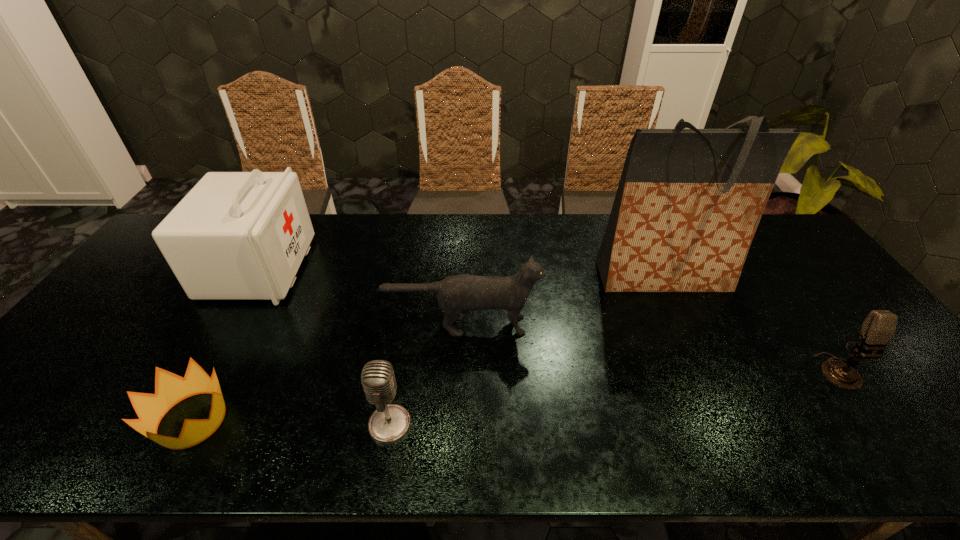
Identify the location of free space between the fifth shortest object and the nearer microphone. (324, 346).

Where is `empty location between the nearer microphone and the first-aid kit`? empty location between the nearer microphone and the first-aid kit is located at coordinates (324, 346).

Select which object appears as the third closest to the first-aid kit. Please provide its 2D coordinates. Your answer should be formatted as a tuple, i.e. [(x, y)], where the tuple contains the x and y coordinates of a point satisfying the conditions above.

[(389, 423)]

Select which object is the closest to the farther microphone. Please provide its 2D coordinates. Your answer should be formatted as a tuple, i.e. [(x, y)], where the tuple contains the x and y coordinates of a point satisfying the conditions above.

[(689, 201)]

Locate an element on the screen. vacant region that satisfies the following two spatial constraints: 1. on the front-facing side of the shopping bag; 2. on the front-facing side of the cat is located at coordinates (684, 325).

In order to click on free location that satisfies the following two spatial constraints: 1. on the front-facing side of the fifth object from left to right; 2. on the front-facing side of the fourth nearest object in this screenshot , I will do `click(684, 325)`.

You are a GUI agent. You are given a task and a screenshot of the screen. Output one action in this format:
    pyautogui.click(x=<x>, y=<y>)
    Task: Click on the free space that satisfies the following two spatial constraints: 1. on the front-facing side of the nearer microphone; 2. on the right side of the first-aid kit
    Image resolution: width=960 pixels, height=540 pixels.
    Given the screenshot: What is the action you would take?
    pyautogui.click(x=170, y=424)